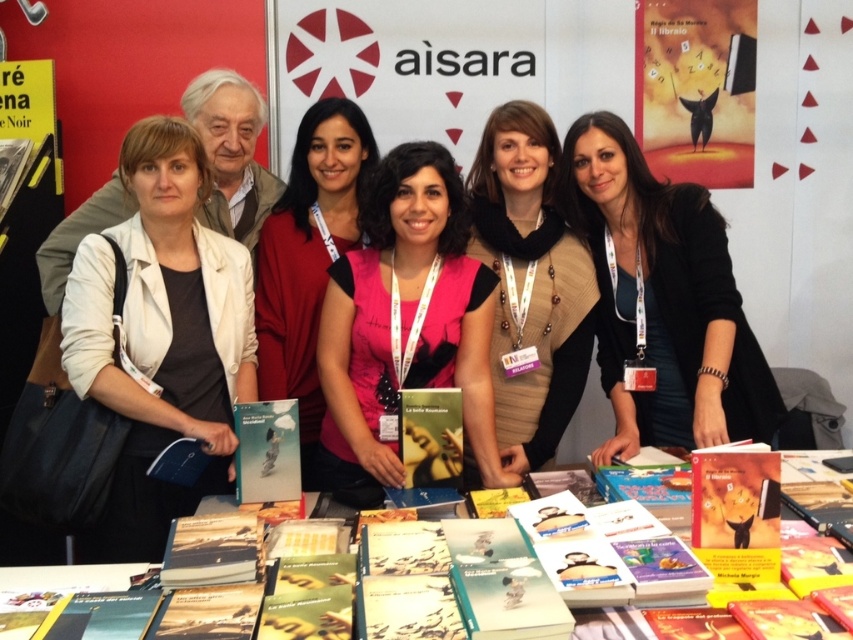
Question: Estimate the real-world distances between objects in this image. Which object is closer to the pink fabric shirt at center?

Choices:
 (A) white matte jacket at left
 (B) matte yellow book at center
 (C) paperback books at center
 (D) pink fabric at center

Answer: (D)

Question: Which of the following is the closest to the observer?

Choices:
 (A) (402, 448)
 (B) (468, 177)

Answer: (A)

Question: Can you confirm if black matte jacket at center is bigger than pink fabric at center?

Choices:
 (A) no
 (B) yes

Answer: (B)

Question: Which of these objects is positioned farthest from the matte yellow book at center?

Choices:
 (A) white matte jacket at left
 (B) matte black book at center
 (C) black matte jacket at center
 (D) pink fabric shirt at center

Answer: (A)

Question: Does white matte jacket at left lie in front of pink fabric at center?

Choices:
 (A) yes
 (B) no

Answer: (A)

Question: Can you confirm if pink fabric shirt at center is positioned below matte yellow book at center?

Choices:
 (A) yes
 (B) no

Answer: (B)